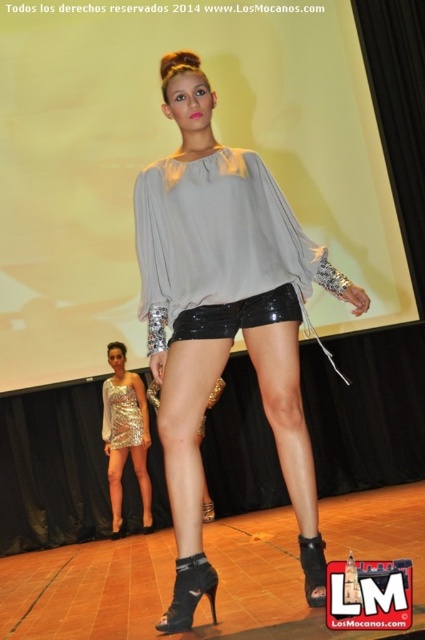
Question: Which of the following is the closest to the observer?

Choices:
 (A) black leather boot at lower center
 (B) shiny sequined dress at center

Answer: (A)

Question: Is black shiny shorts at center bigger than shiny sequined dress at center?

Choices:
 (A) no
 (B) yes

Answer: (A)

Question: Is black leather boot at lower center positioned before shiny sequined dress at center?

Choices:
 (A) no
 (B) yes

Answer: (B)

Question: Does matte gray blouse at center lie behind black patent leather boot at center?

Choices:
 (A) yes
 (B) no

Answer: (A)

Question: Which point is closer to the camera?

Choices:
 (A) silver sequined dress at center
 (B) matte gray blouse at center

Answer: (B)

Question: Which point is closer to the camera?

Choices:
 (A) (252, 326)
 (B) (119, 513)
 (C) (172, 387)
 (D) (311, 598)

Answer: (D)